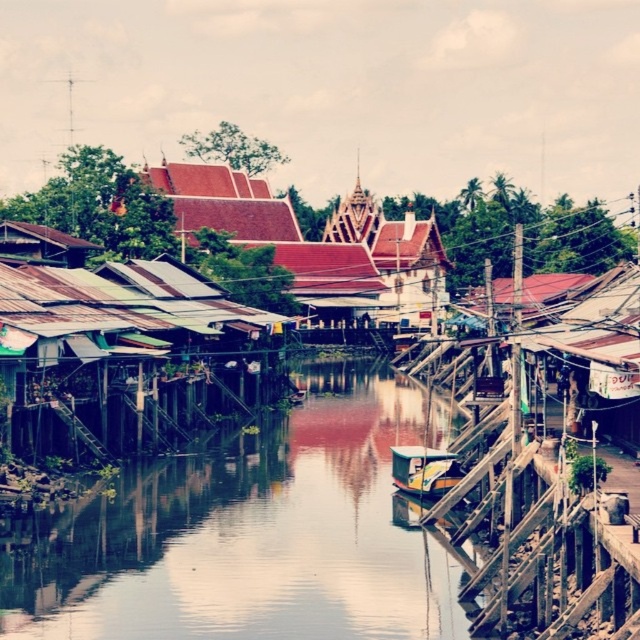
You are standing at the point with coordinates (252, 536) in the riverside scene. What type of surface are you standing on?

You are standing on the smooth concrete river at center.

You are a tourist standing on the riverside path and want to take a photo of the smooth concrete river at center and the green plastic boat at center. Which one should you focus on first to ensure both are in frame?

The smooth concrete river at center is in front of the green plastic boat at center, so you should focus on the green plastic boat at center first to ensure both are in frame.